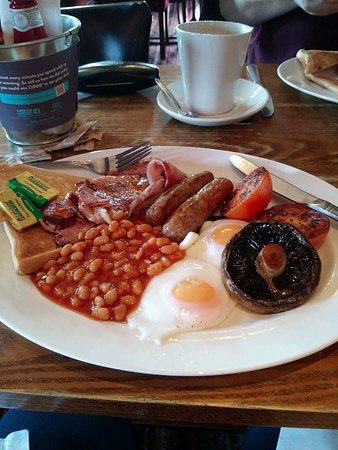
Where is `silver teaspoon`? silver teaspoon is located at coordinates (182, 112).